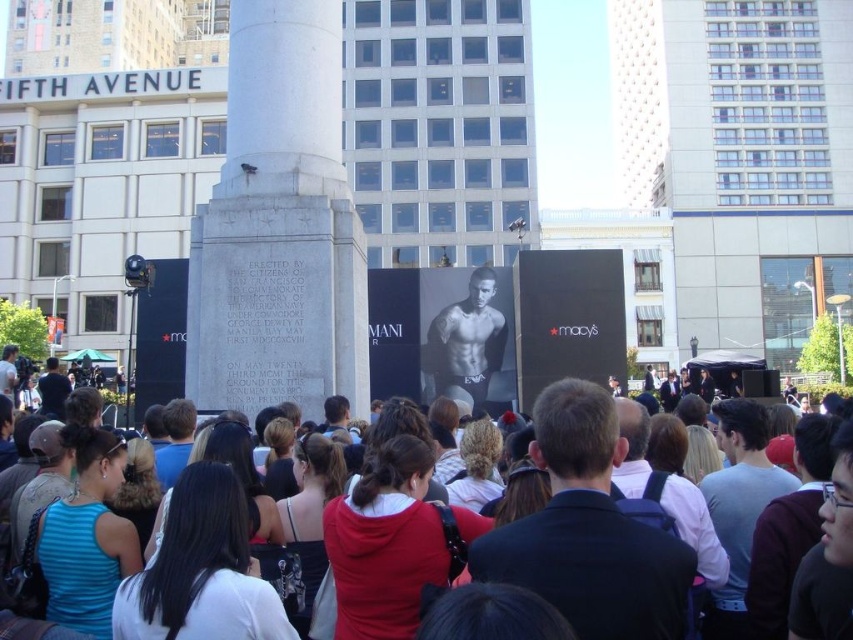
You are a photographer trying to capture a photo of the smooth skin torso at center without the white marble monument at center blocking it. What should you do?

Since the white marble monument at center is much taller than the smooth skin torso at center, you can move to a lower position to ensure the monument doesn